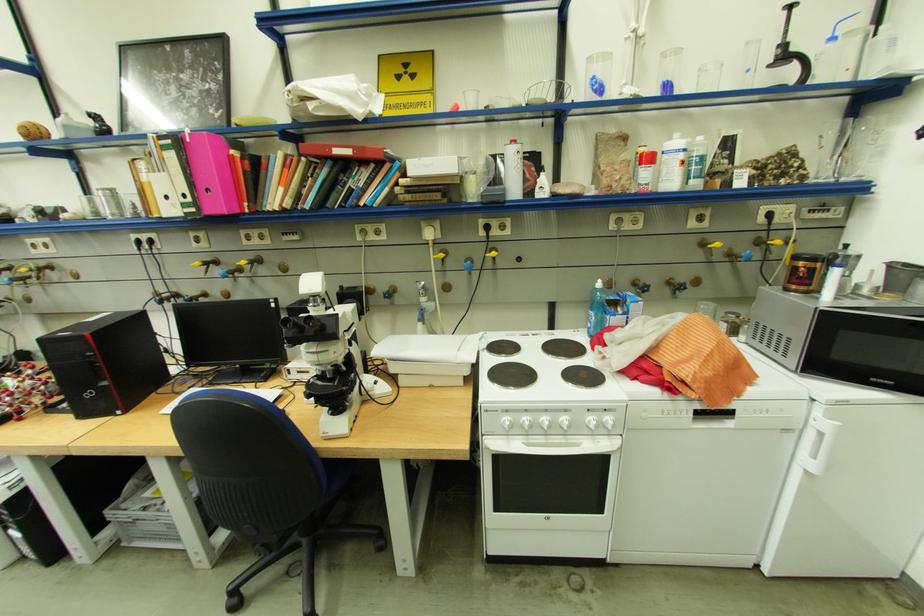
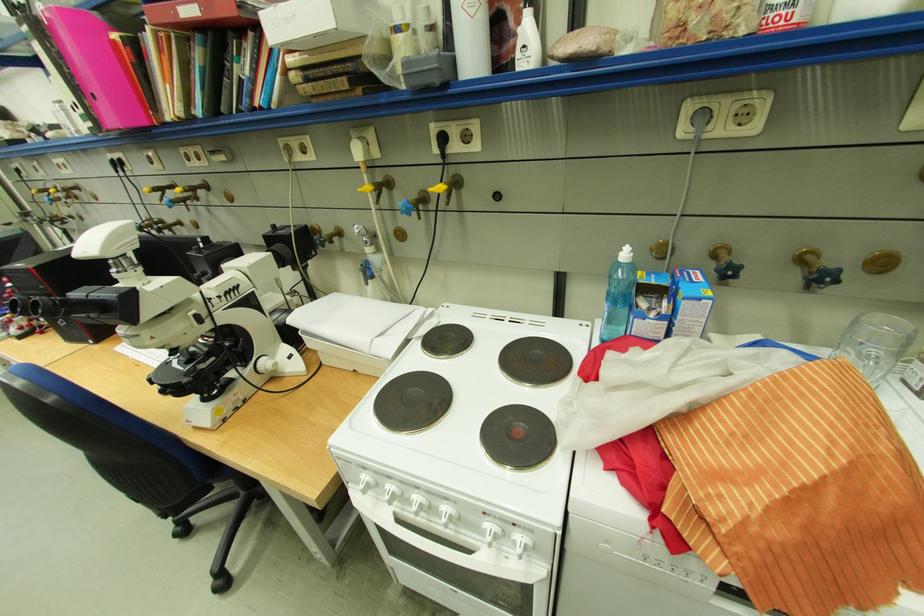
In a continuous first-person perspective shot, in which direction is the camera moving?

The cameraman walked toward right, forward.